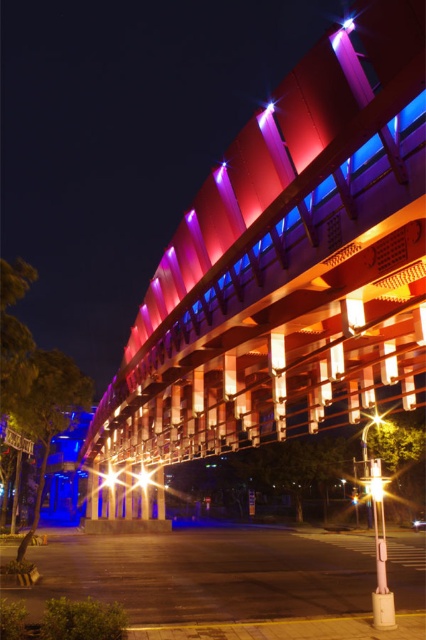
Who is shorter, bright metallic streetlight at center or bright metallic light at center?

bright metallic light at center is shorter.

Who is positioned more to the right, bright metallic streetlight at center or bright metallic light at center?

From the viewer's perspective, bright metallic streetlight at center appears more on the right side.

Is point (146, 483) less distant than point (115, 472)?

No.

You are a GUI agent. You are given a task and a screenshot of the screen. Output one action in this format:
    pyautogui.click(x=<x>, y=<y>)
    Task: Click on the bright metallic streetlight at center
    This screenshot has height=640, width=426.
    Given the screenshot: What is the action you would take?
    pyautogui.click(x=143, y=477)